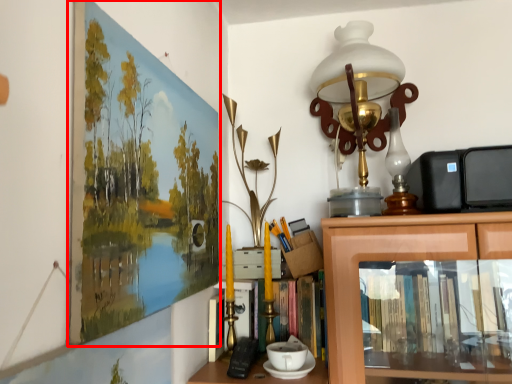
Question: From the image's perspective, where is picture frame (annotated by the red box) located in relation to table lamp in the image?

Choices:
 (A) above
 (B) below

Answer: (B)